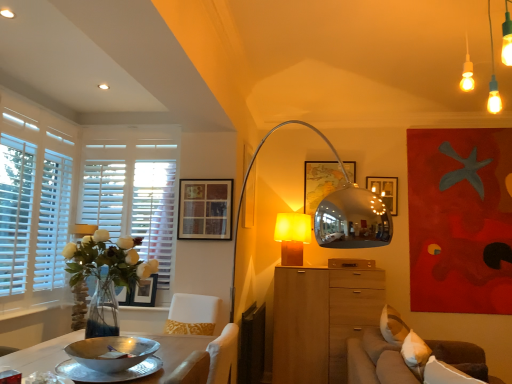
The width and height of the screenshot is (512, 384). I want to click on free space above white wood window frame at left (from a real-world perspective), so click(x=128, y=118).